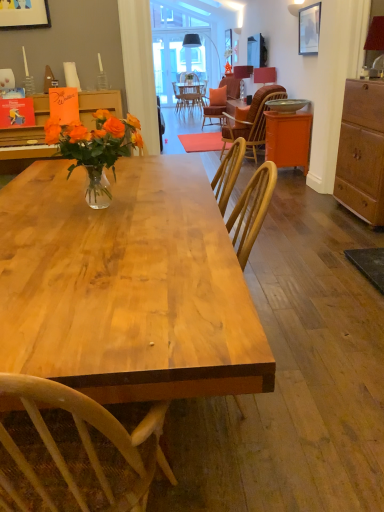
Question: Based on their positions, is matte red lampshade at upper right, acting as the third lamp starting from the left, located to the left or right of matte red lampshade at upper right, which is the second lamp from right to left?

Choices:
 (A) right
 (B) left

Answer: (A)

Question: From a real-world perspective, is matte red lampshade at upper right, the 1th lamp when ordered from bottom to top, above or below matte red lampshade at upper right, which is the 2th lamp from top to bottom?

Choices:
 (A) above
 (B) below

Answer: (A)

Question: Estimate the real-world distances between objects in this image. Which object is closer to the natural wood table at center?

Choices:
 (A) matte red lampshade at upper right, placed as the 2th lamp when sorted from left to right
 (B) matte black lampshade at upper center, which ranks as the third lamp in bottom-to-top order
 (C) matte black picture frame at upper right
 (D) wooden wicker chair at center
 (E) wooden cabinet at right

Answer: (E)

Question: Which is farther from the wooden wicker chair at center?

Choices:
 (A) matte red lampshade at upper right, the 3th lamp positioned from the back
 (B) matte black lampshade at upper center, which ranks as the third lamp in bottom-to-top order
 (C) matte red lampshade at upper right, which is the second lamp from front to back
 (D) orange matte cabinet at right
 (E) orange glass vase at center

Answer: (E)